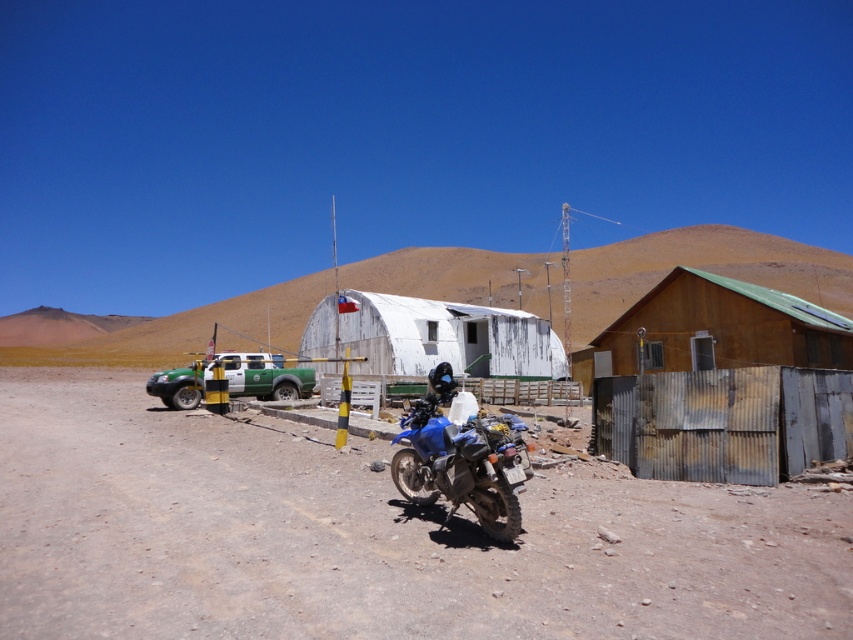
Between dusty gravel road at center and rusty corrugated hut at right, which one is positioned higher?

rusty corrugated hut at right is above.

Is dusty gravel road at center wider than rusty corrugated hut at right?

Indeed, dusty gravel road at center has a greater width compared to rusty corrugated hut at right.

The image size is (853, 640). In order to click on dusty gravel road at center in this screenshot , I will do `click(370, 536)`.

Which of these two, white corrugated metal building at center or rusty corrugated hut at right, stands shorter?

With less height is rusty corrugated hut at right.

From the picture: Between white corrugated metal building at center and rusty corrugated hut at right, which one appears on the left side from the viewer's perspective?

Positioned to the left is white corrugated metal building at center.

Is point (93, 360) more distant than point (808, 348)?

That is True.

The width and height of the screenshot is (853, 640). I want to click on white corrugated metal building at center, so click(x=700, y=268).

Can you confirm if dusty gravel road at center is positioned to the left of white weathered hut at center?

Correct, you'll find dusty gravel road at center to the left of white weathered hut at center.

Can you confirm if dusty gravel road at center is shorter than white weathered hut at center?

Correct, dusty gravel road at center is not as tall as white weathered hut at center.

Between point (677, 508) and point (404, 358), which one is positioned in front?

Point (677, 508)

The image size is (853, 640). I want to click on dusty gravel road at center, so click(x=370, y=536).